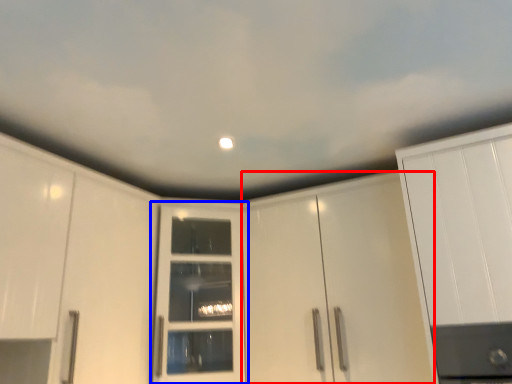
Question: Which object appears closest to the camera in this image, cabinetry (highlighted by a red box) or door (highlighted by a blue box)?

Choices:
 (A) cabinetry
 (B) door

Answer: (A)